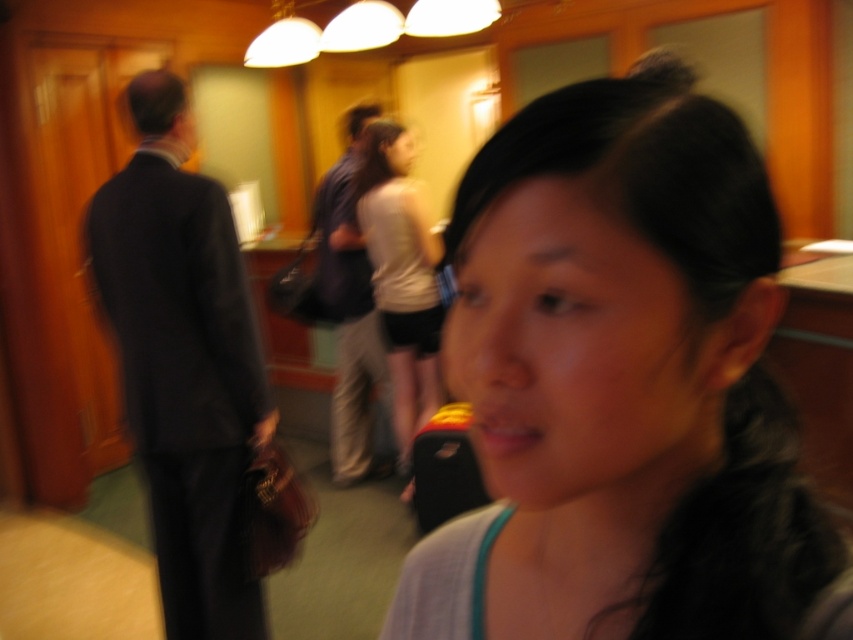
You are a photographer trying to capture a clear portrait of the person at the center of the image. Given that the smooth skin face at center and the white matte shirt at center are both in focus, which one should you adjust your camera settings to prioritize focusing on?

The smooth skin face at center has a lesser width compared to the white matte shirt at center, so you should prioritize focusing on the smooth skin face at center to ensure its details are sharp.

You are a photographer trying to capture a clear shot of both the white matte shirt at center and the dark blue suit at center. Based on their positions, which one should you focus on first to ensure both are in focus?

The white matte shirt at center is below the dark blue suit at center, so focusing on the dark blue suit at center first would allow the photographer to adjust the focus upwards, ensuring both are in focus.

You are a photographer trying to adjust your camera focus. You notice two subjects in the image at the center of the frame, the smooth skin face at center and the dark blue suit at center. Which one is closer to the camera?

The smooth skin face at center has a lesser height compared to dark blue suit at center, so it is closer to the camera.